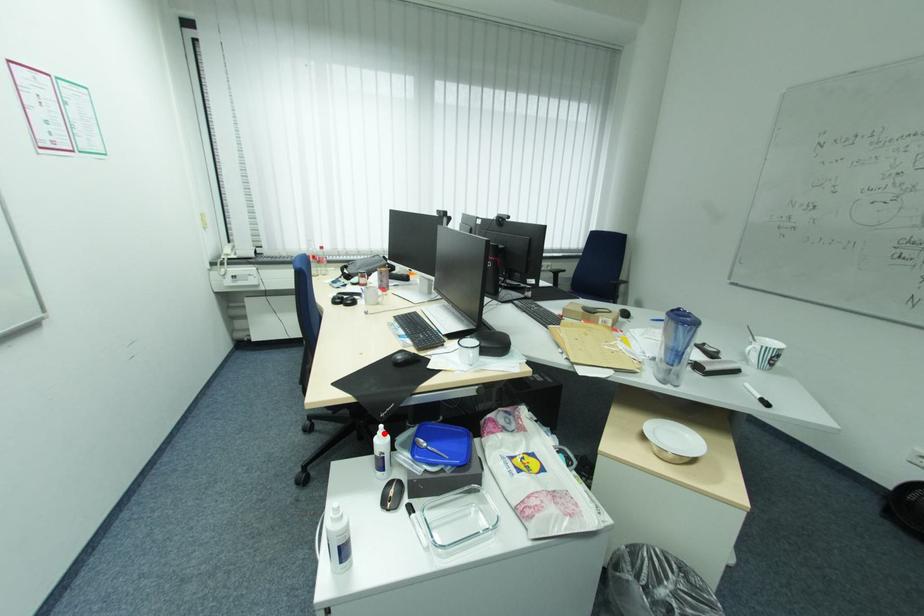
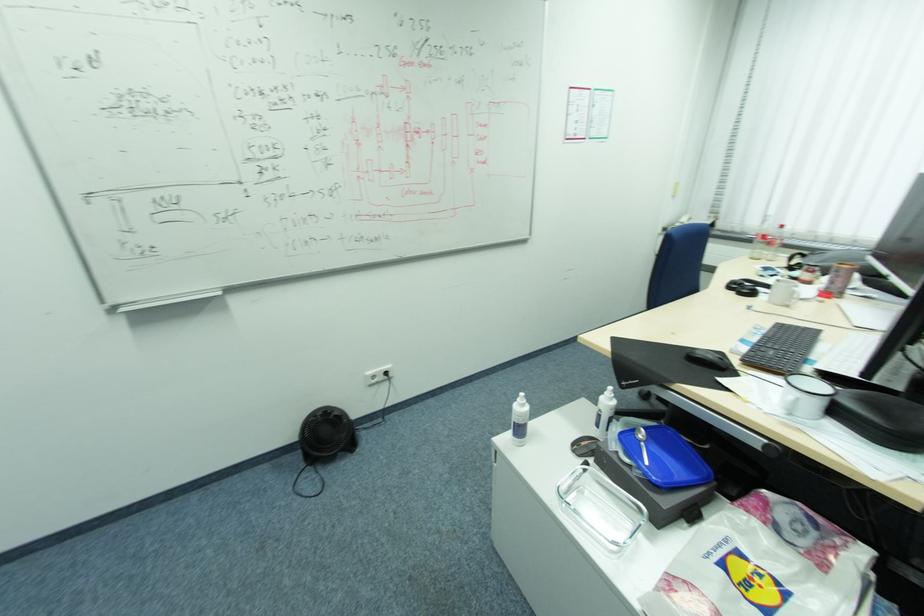
Question: I am providing you with two images of the same scene from different viewpoints. A red point is shown in image1. For the corresponding object point in image2, is it positioned nearer or farther from the camera?

Choices:
 (A) Nearer
 (B) Farther

Answer: (A)